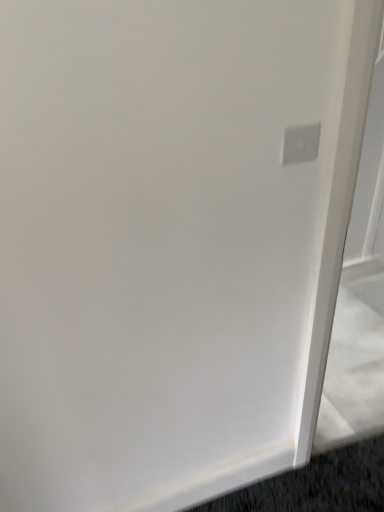
Find the location of `white plastic electric outlet at upper right`. white plastic electric outlet at upper right is located at coordinates (300, 144).

This screenshot has width=384, height=512. Describe the element at coordinates (300, 144) in the screenshot. I see `white plastic electric outlet at upper right` at that location.

In order to face white plastic electric outlet at upper right, should I rotate leftwards or rightwards?

To face it directly, rotate right by 14.067 degrees.

This screenshot has height=512, width=384. I want to click on white plastic electric outlet at upper right, so click(x=300, y=144).